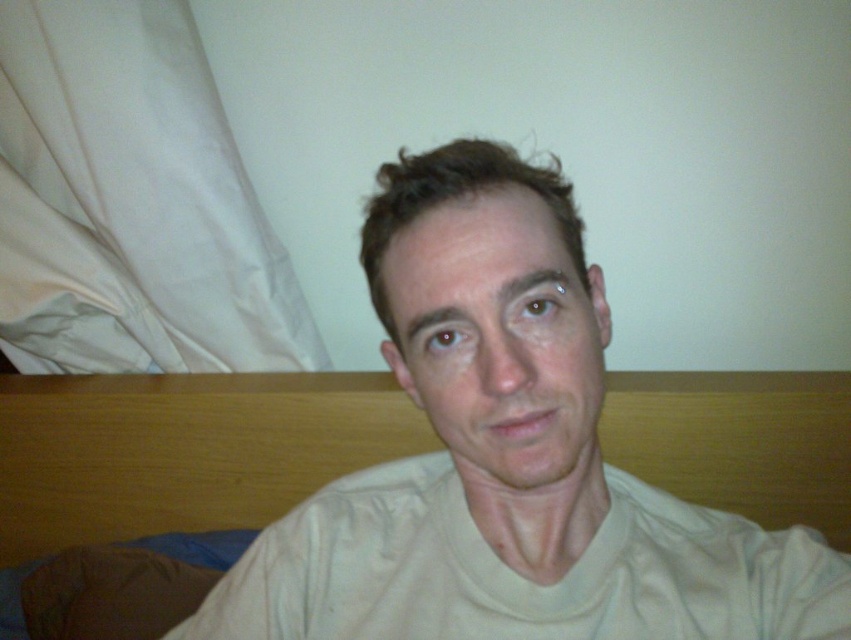
You are taking a photo of the light beige cotton shirt at center and the wooden bed at center. Which object is positioned closer to the camera?

The light beige cotton shirt at center is closer to the viewer than the wooden bed at center, so it is positioned closer to the camera.

The person in the image is wearing a light beige cotton shirt at center. If you were to draw a line from the top of the headboard to the bottom of the light beige cotton shirt at center, would that line pass through the point at coordinates point (x=507, y=458)?

Yes, the line from the top of the headboard to the bottom of the light beige cotton shirt at center would pass through point (x=507, y=458) because that is exactly where the light beige cotton shirt at center is located.

You are a fashion designer analyzing the image. You need to determine if the light beige cotton shirt at center can be worn over a sweater without looking too bulky. Considering the height of the wooden bed at center as a reference, can you assess if the shirt is shorter than the bed?

The light beige cotton shirt at center is taller than the wooden bed at center, so it is not shorter. Therefore, the shirt might be long enough to be worn over a sweater without appearing too bulky.